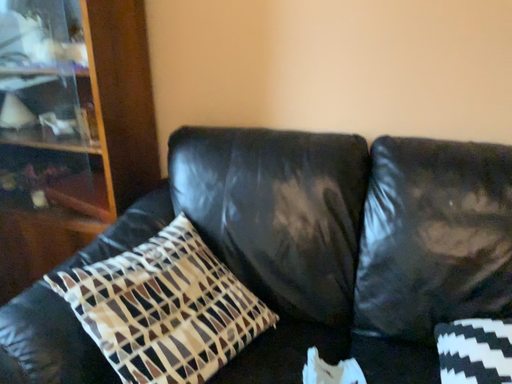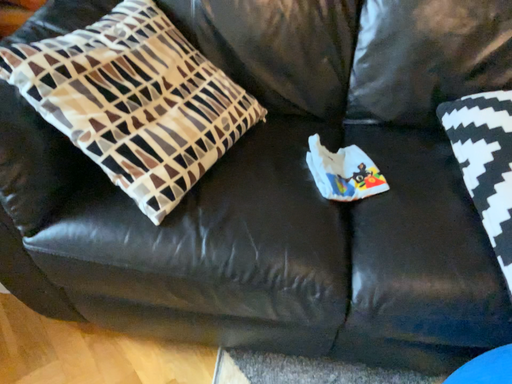
Question: How did the camera likely rotate when shooting the video?

Choices:
 (A) rotated downward
 (B) rotated upward

Answer: (A)